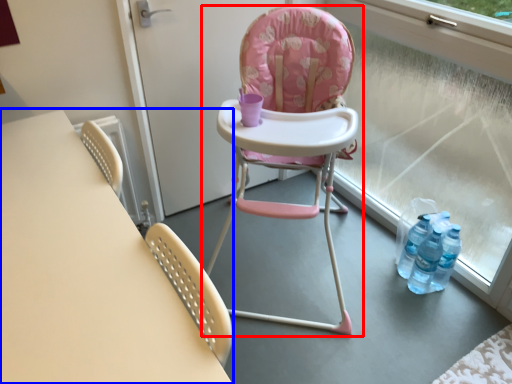
Question: Which of the following is the farthest to the observer, chair (highlighted by a red box) or table (highlighted by a blue box)?

Choices:
 (A) chair
 (B) table

Answer: (A)